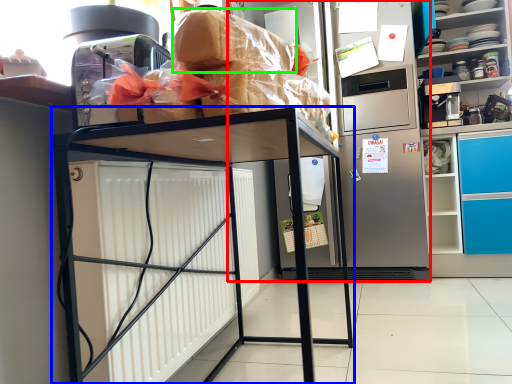
Question: Estimate the real-world distances between objects in this image. Which object is farther from appliance (highlighted by a red box), furniture (highlighted by a blue box) or bread (highlighted by a green box)?

Choices:
 (A) furniture
 (B) bread

Answer: (B)